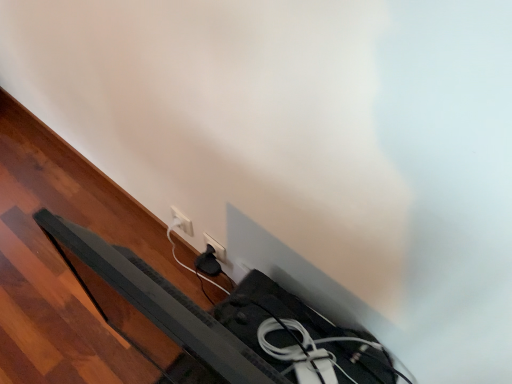
Question: From a real-world perspective, does black plastic bed frame at lower left sit lower than white plastic socket at lower center, which is counted as the first power plugs and sockets, starting from the left?

Choices:
 (A) no
 (B) yes

Answer: (A)

Question: Is black plastic bed frame at lower left at the right side of white plastic socket at lower center, positioned as the second power plugs and sockets in right-to-left order?

Choices:
 (A) no
 (B) yes

Answer: (B)

Question: Could you tell me if black plastic bed frame at lower left is turned towards white plastic socket at lower center, which is counted as the first power plugs and sockets, starting from the left?

Choices:
 (A) no
 (B) yes

Answer: (A)

Question: Does black plastic bed frame at lower left have a larger size compared to white plastic socket at lower center, positioned as the second power plugs and sockets in right-to-left order?

Choices:
 (A) no
 (B) yes

Answer: (B)

Question: Considering the relative sizes of black plastic bed frame at lower left and white plastic socket at lower center, positioned as the second power plugs and sockets in right-to-left order, in the image provided, is black plastic bed frame at lower left taller than white plastic socket at lower center, positioned as the second power plugs and sockets in right-to-left order,?

Choices:
 (A) no
 (B) yes

Answer: (B)

Question: Are black plastic bed frame at lower left and white plastic socket at lower center, positioned as the second power plugs and sockets in right-to-left order, located far from each other?

Choices:
 (A) yes
 (B) no

Answer: (B)

Question: Does black plastic bed frame at lower left lie in front of white plastic power plug at lower center, arranged as the second power plugs and sockets when viewed from the left?

Choices:
 (A) no
 (B) yes

Answer: (B)

Question: Considering the relative positions of black plastic bed frame at lower left and white plastic power plug at lower center, arranged as the second power plugs and sockets when viewed from the left, in the image provided, is black plastic bed frame at lower left behind white plastic power plug at lower center, arranged as the second power plugs and sockets when viewed from the left,?

Choices:
 (A) no
 (B) yes

Answer: (A)

Question: From the image's perspective, is black plastic bed frame at lower left on white plastic power plug at lower center, the first power plugs and sockets positioned from the right?

Choices:
 (A) no
 (B) yes

Answer: (A)

Question: Is black plastic bed frame at lower left taller than white plastic power plug at lower center, arranged as the second power plugs and sockets when viewed from the left?

Choices:
 (A) yes
 (B) no

Answer: (A)

Question: From a real-world perspective, is black plastic bed frame at lower left over white plastic power plug at lower center, arranged as the second power plugs and sockets when viewed from the left?

Choices:
 (A) yes
 (B) no

Answer: (A)

Question: Is black plastic bed frame at lower left oriented towards white plastic power plug at lower center, arranged as the second power plugs and sockets when viewed from the left?

Choices:
 (A) yes
 (B) no

Answer: (B)

Question: Considering the relative sizes of white plastic socket at lower center, which is counted as the first power plugs and sockets, starting from the left, and black plastic bed frame at lower left in the image provided, is white plastic socket at lower center, which is counted as the first power plugs and sockets, starting from the left, shorter than black plastic bed frame at lower left?

Choices:
 (A) yes
 (B) no

Answer: (A)